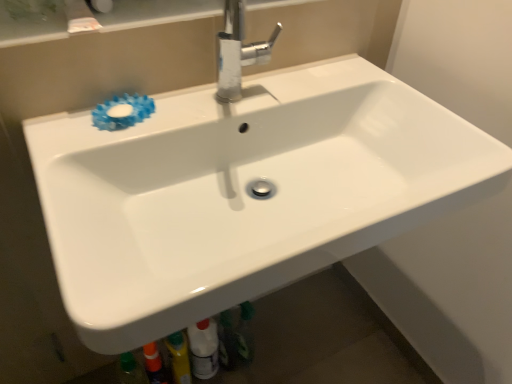
Identify the location of free spot in front of blue rubber flower at upper left. This screenshot has width=512, height=384. (x=90, y=156).